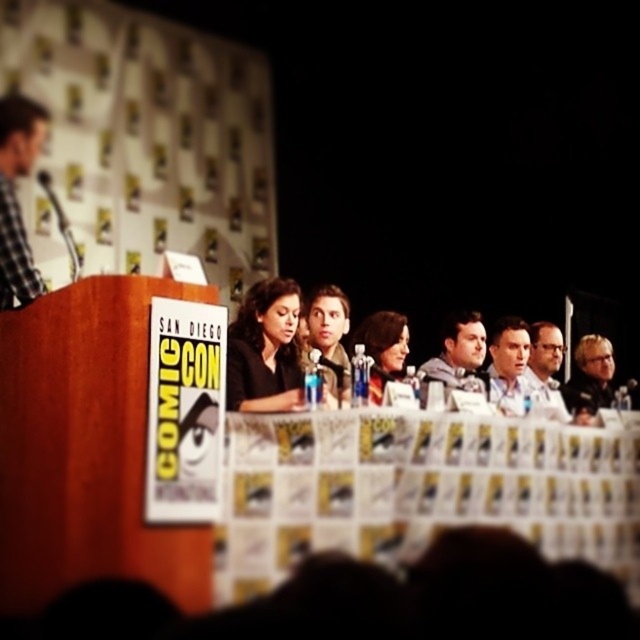
Question: Does matte black hair at center have a greater width compared to blonde hair at right?

Choices:
 (A) yes
 (B) no

Answer: (B)

Question: Is white paper at center above matte black hair at center?

Choices:
 (A) no
 (B) yes

Answer: (A)

Question: Where is white paper at center located in relation to gray fabric jacket at center in the image?

Choices:
 (A) left
 (B) right

Answer: (A)

Question: Which of these objects is positioned closest to the blonde hair at right?

Choices:
 (A) white paper at center
 (B) checkered fabric shirt at left
 (C) matte black hair at center

Answer: (A)

Question: Which point is farther from the camera taking this photo?

Choices:
 (A) (360, 556)
 (B) (356, 336)
 (C) (472, 352)

Answer: (C)

Question: Among these objects, which one is nearest to the camera?

Choices:
 (A) checkered fabric shirt at left
 (B) blonde hair at right
 (C) white paper at center
 (D) gray fabric jacket at center

Answer: (C)